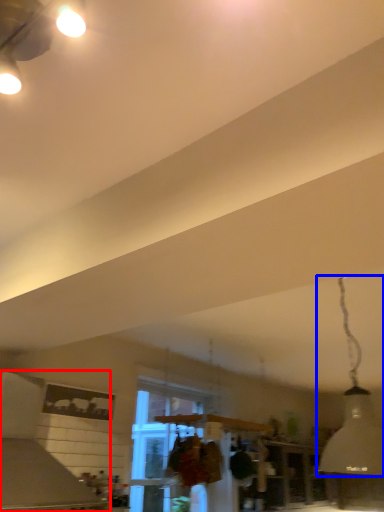
Question: Among these objects, which one is farthest to the camera, vent (highlighted by a red box) or lamp (highlighted by a blue box)?

Choices:
 (A) vent
 (B) lamp

Answer: (A)